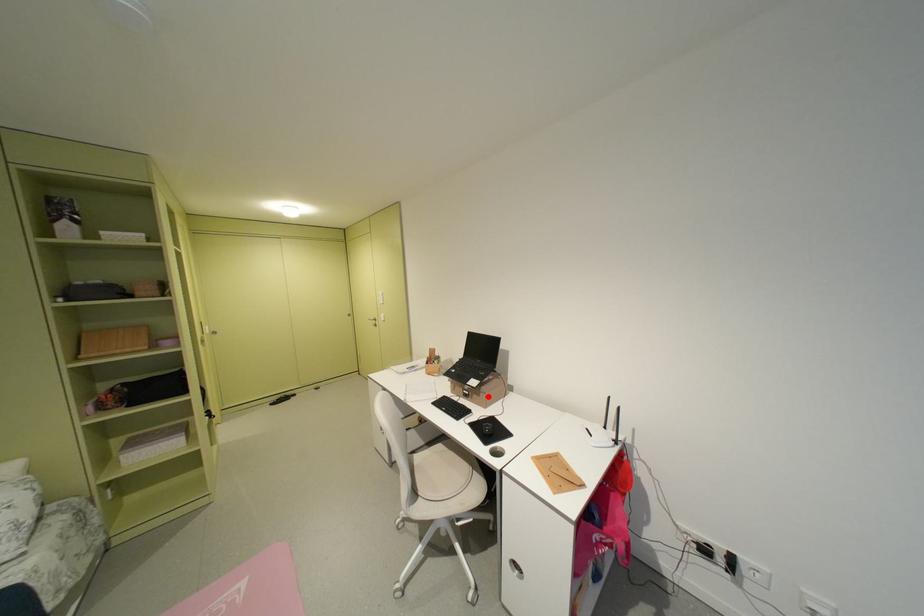
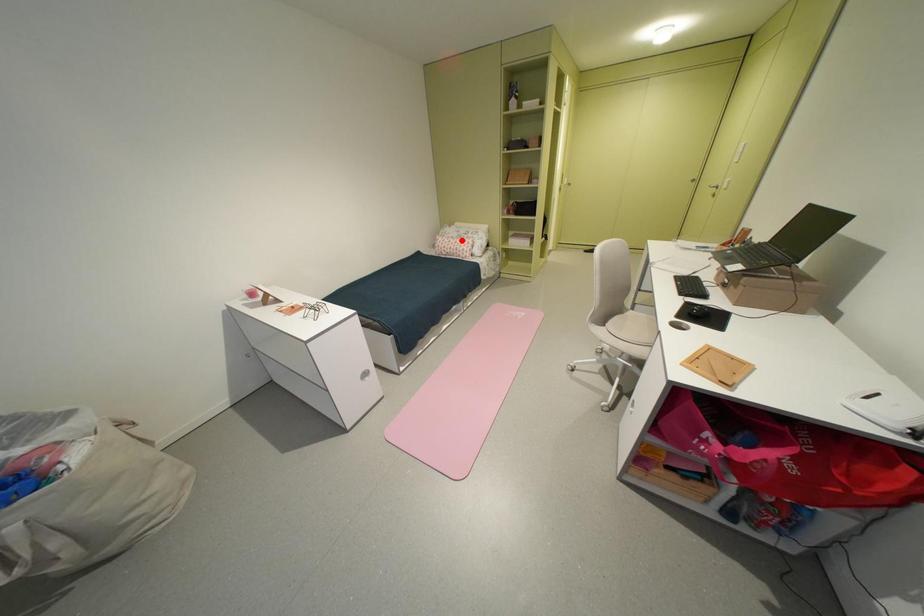
I am providing you with two images of the same scene from different viewpoints. A red point is marked on the first image and another point is marked on the second image. Does the point marked in image1 correspond to the same location as the one in image2?

No